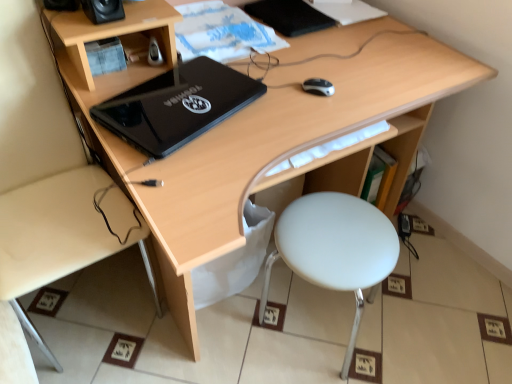
The height and width of the screenshot is (384, 512). Find the location of `spots to the right of white plastic stool at lower right`. spots to the right of white plastic stool at lower right is located at coordinates (422, 319).